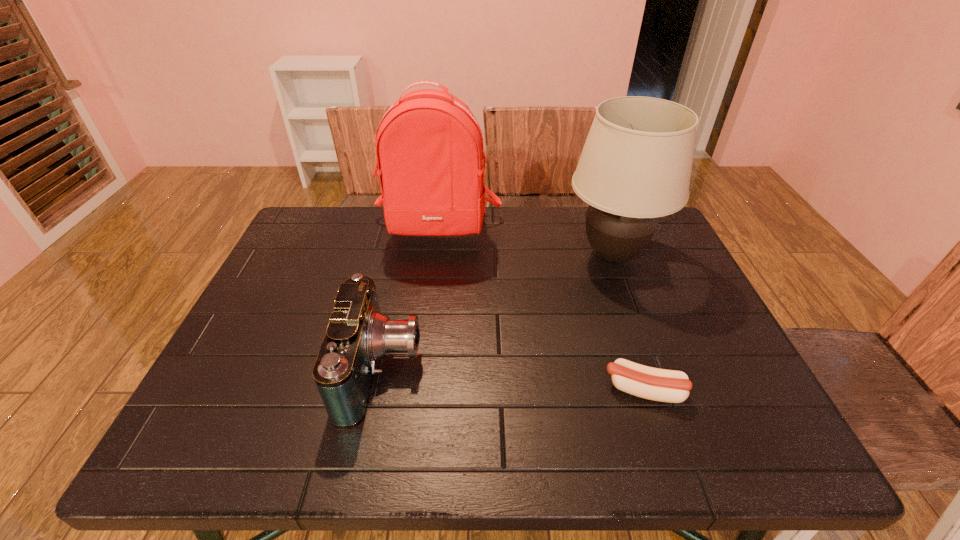
Locate an element on the screen. vacant point located between the shortest object and the third tallest object is located at coordinates (513, 380).

You are a GUI agent. You are given a task and a screenshot of the screen. Output one action in this format:
    pyautogui.click(x=<x>, y=<y>)
    Task: Click on the vacant region between the lampshade and the backpack
    Image resolution: width=960 pixels, height=540 pixels.
    Given the screenshot: What is the action you would take?
    pyautogui.click(x=525, y=242)

The height and width of the screenshot is (540, 960). What are the coordinates of `vacant point located between the backpack and the lampshade` in the screenshot? It's located at (525, 242).

Locate an element on the screen. The height and width of the screenshot is (540, 960). vacant area that lies between the shortest object and the backpack is located at coordinates (540, 310).

At what (x,y) coordinates should I click in order to perform the action: click on free space that is in between the camcorder and the sausage. Please return your answer as a coordinate pair (x, y). Looking at the image, I should click on (513, 380).

Find the location of `vacant point located between the camcorder and the shortest object`. vacant point located between the camcorder and the shortest object is located at coordinates [513, 380].

I want to click on empty location between the backpack and the second shortest object, so click(410, 300).

Where is `vacant region between the backpack and the lampshade`? The height and width of the screenshot is (540, 960). vacant region between the backpack and the lampshade is located at coordinates (525, 242).

This screenshot has width=960, height=540. In order to click on free point between the backpack and the lampshade in this screenshot , I will do `click(525, 242)`.

Locate an element on the screen. This screenshot has width=960, height=540. object identified as the closest to the sausage is located at coordinates (635, 166).